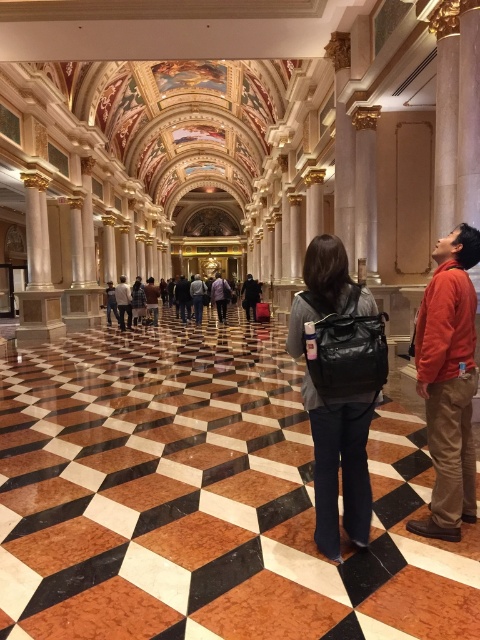
Question: Can you confirm if orange cotton jacket at right is positioned to the left of purple fabric jacket at center?

Choices:
 (A) no
 (B) yes

Answer: (A)

Question: Among these objects, which one is farthest from the camera?

Choices:
 (A) dark gray backpack at center
 (B) matte black backpack at center

Answer: (A)

Question: Which of the following is the closest to the observer?

Choices:
 (A) (250, 278)
 (B) (145, 296)
 (C) (220, 310)

Answer: (B)

Question: Which is farther from the brown leather backpack at center?

Choices:
 (A) dark gray backpack at center
 (B) orange cotton jacket at right
 (C) dark gray sweater at center
 (D) purple fabric jacket at center

Answer: (B)

Question: Does orange cotton jacket at right have a greater width compared to purple fabric jacket at center?

Choices:
 (A) yes
 (B) no

Answer: (B)

Question: Does orange cotton jacket at right appear on the right side of purple fabric jacket at center?

Choices:
 (A) yes
 (B) no

Answer: (A)